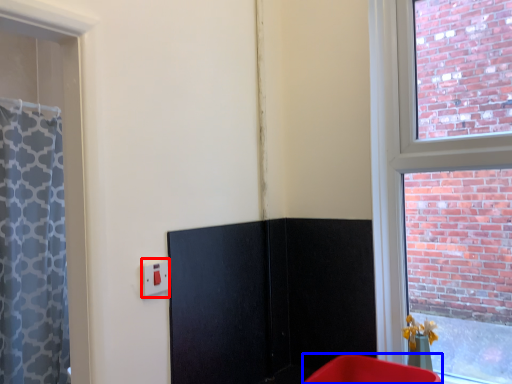
Question: Which object is further to the camera taking this photo, electric outlet (highlighted by a red box) or furniture (highlighted by a blue box)?

Choices:
 (A) electric outlet
 (B) furniture

Answer: (A)